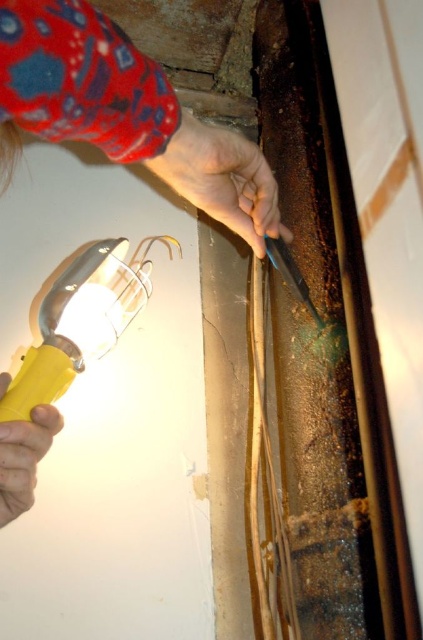
Question: Estimate the real-world distances between objects in this image. Which object is closer to the yellow plastic flashlight at lower left?

Choices:
 (A) matte fabric hand at upper center
 (B) smooth skin hand at upper center

Answer: (A)

Question: Does matte fabric hand at upper center have a smaller size compared to smooth skin hand at upper center?

Choices:
 (A) yes
 (B) no

Answer: (B)

Question: Does matte fabric hand at upper center appear on the right side of smooth skin hand at upper center?

Choices:
 (A) yes
 (B) no

Answer: (B)

Question: Among these objects, which one is nearest to the camera?

Choices:
 (A) matte fabric hand at upper center
 (B) yellow plastic flashlight at lower left
 (C) smooth skin hand at upper center

Answer: (A)

Question: Which is farther from the matte fabric hand at upper center?

Choices:
 (A) yellow plastic flashlight at lower left
 (B) smooth skin hand at upper center

Answer: (A)

Question: Does smooth skin hand at upper center have a greater width compared to yellow plastic flashlight at lower left?

Choices:
 (A) yes
 (B) no

Answer: (A)